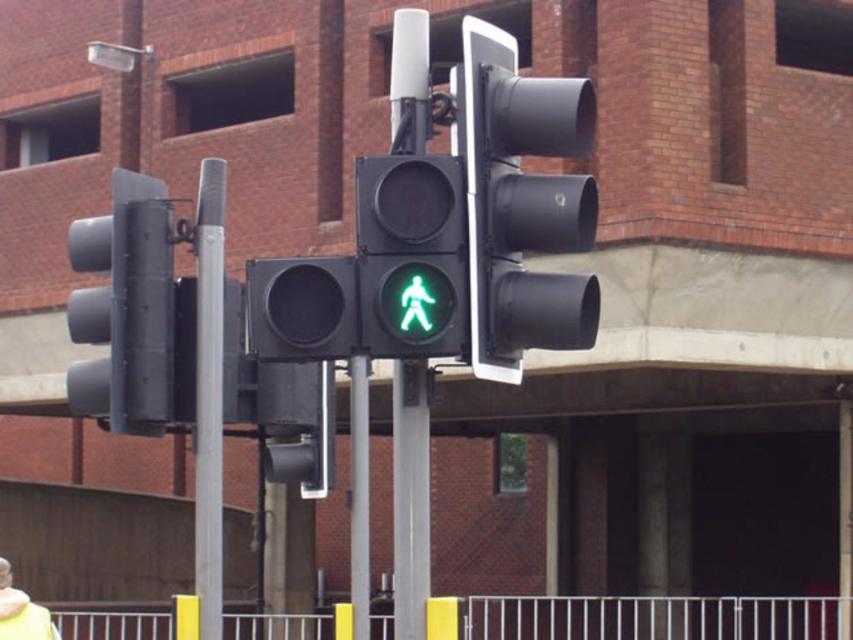
Does matte black traffic light at left come behind green matte pedestrian signal at center?

Yes, it is behind green matte pedestrian signal at center.

Is point (102, 394) behind point (450, 220)?

Yes, point (102, 394) is behind point (450, 220).

Between point (161, 368) and point (456, 200), which one is positioned in front?

Point (456, 200)

This screenshot has width=853, height=640. What are the coordinates of `matte black traffic light at left` in the screenshot? It's located at (125, 308).

Between green matte pedestrian signal at center and silver metallic pole at left, which one is positioned higher?

Positioned higher is green matte pedestrian signal at center.

Is point (392, 257) farther from viewer compared to point (196, 200)?

No.

Who is more forward, (413, 305) or (199, 552)?

Positioned in front is point (413, 305).

Where is `green matte pedestrian signal at center`? Image resolution: width=853 pixels, height=640 pixels. green matte pedestrian signal at center is located at coordinates (410, 256).

Is matte black traffic light at left smaller than yellow woolen jacket at lower left?

No, matte black traffic light at left is not smaller than yellow woolen jacket at lower left.

Is point (78, 230) behind point (4, 576)?

No, it is not.

Does point (82, 240) lie behind point (25, 596)?

That is False.

At what (x,y) coordinates should I click in order to perform the action: click on matte black traffic light at left. Please return your answer as a coordinate pair (x, y). This screenshot has height=640, width=853. Looking at the image, I should click on (125, 308).